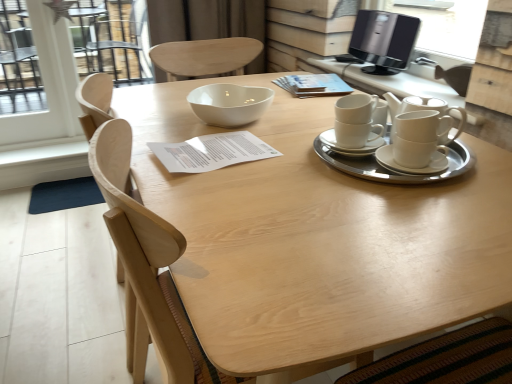
This screenshot has height=384, width=512. Identify the location of black glossy computer monitor at upper right. (383, 40).

Measure the distance between white ceramic tea set at right and camera.

The depth of white ceramic tea set at right is 35.35 inches.

The image size is (512, 384). What do you see at coordinates (147, 267) in the screenshot? I see `light wood chair at center` at bounding box center [147, 267].

The height and width of the screenshot is (384, 512). Identify the location of white ceramic saucer at right. (350, 148).

Where is `white ceramic cups at upper right, the second table ordered from the bottom`? The image size is (512, 384). white ceramic cups at upper right, the second table ordered from the bottom is located at coordinates (389, 82).

Image resolution: width=512 pixels, height=384 pixels. What are the coordinates of `black glossy computer monitor at upper right` in the screenshot? It's located at (383, 40).

Is black glossy computer monitor at upper right wider or thinner than white ceramic saucer at right?

In the image, black glossy computer monitor at upper right appears to be wider than white ceramic saucer at right.

Image resolution: width=512 pixels, height=384 pixels. I want to click on saucer that appears on the left of black glossy computer monitor at upper right, so click(350, 148).

Is black glossy computer monitor at upper right shorter than white ceramic saucer at right?

No.

Can you tell me how much black glossy computer monitor at upper right and white ceramic saucer at right differ in facing direction?

2.82 degrees.

Between white glossy bowl at center and light wood chair at center, which one is positioned behind?

white glossy bowl at center is further from the camera.

Is point (227, 91) behind point (106, 147)?

Yes, point (227, 91) is behind point (106, 147).

Does white glossy bowl at center appear on the right side of light wood chair at center?

Indeed, white glossy bowl at center is positioned on the right side of light wood chair at center.

In terms of size, does white glossy bowl at center appear bigger or smaller than light wood chair at center?

In the image, white glossy bowl at center appears to be smaller than light wood chair at center.

Is white ceramic cups at upper right, which appears as the first table when viewed from the top, in front of natural wood table at center, the 2th table viewed from the top?

No, the depth of white ceramic cups at upper right, which appears as the first table when viewed from the top, is greater than that of natural wood table at center, the 2th table viewed from the top.

Does white ceramic cups at upper right, which appears as the first table when viewed from the top, have a larger size compared to natural wood table at center, which is the 1th table in bottom-to-top order?

No, white ceramic cups at upper right, which appears as the first table when viewed from the top, is not bigger than natural wood table at center, which is the 1th table in bottom-to-top order.

Is black glossy computer monitor at upper right at the left side of white glossy bowl at center?

In fact, black glossy computer monitor at upper right is to the right of white glossy bowl at center.

Choose the correct answer: Is black glossy computer monitor at upper right inside white glossy bowl at center or outside it?

The correct answer is: outside.

In terms of size, does black glossy computer monitor at upper right appear bigger or smaller than white glossy bowl at center?

In the image, black glossy computer monitor at upper right appears to be larger than white glossy bowl at center.

Considering the sizes of white ceramic tea set at right and natural wood table at center, the 2th table viewed from the top, in the image, is white ceramic tea set at right bigger or smaller than natural wood table at center, the 2th table viewed from the top,?

white ceramic tea set at right is smaller than natural wood table at center, the 2th table viewed from the top.

From a real-world perspective, who is located lower, white ceramic tea set at right or natural wood table at center, the 2th table viewed from the top?

natural wood table at center, the 2th table viewed from the top, is physically lower.

From the image's perspective, is white ceramic tea set at right under natural wood table at center, which is the 1th table in bottom-to-top order?

No, from the image's perspective, white ceramic tea set at right is not beneath natural wood table at center, which is the 1th table in bottom-to-top order.

Is white ceramic tea set at right taller or shorter than natural wood table at center, the 2th table viewed from the top?

In the image, white ceramic tea set at right appears to be shorter than natural wood table at center, the 2th table viewed from the top.

Can you confirm if natural wood table at center, the 2th table viewed from the top, is wider than white ceramic saucer at right?

Yes, natural wood table at center, the 2th table viewed from the top, is wider than white ceramic saucer at right.

Which is more to the left, natural wood table at center, which is the 1th table in bottom-to-top order, or white ceramic saucer at right?

natural wood table at center, which is the 1th table in bottom-to-top order, is more to the left.

From the image's perspective, is natural wood table at center, the 2th table viewed from the top, on white ceramic saucer at right?

Incorrect, from the image's perspective, natural wood table at center, the 2th table viewed from the top, is lower than white ceramic saucer at right.

Considering the sizes of objects natural wood table at center, the 2th table viewed from the top, and white ceramic saucer at right in the image provided, who is bigger, natural wood table at center, the 2th table viewed from the top, or white ceramic saucer at right?

natural wood table at center, the 2th table viewed from the top, is bigger.

Is white glossy bowl at center positioned with its back to white ceramic cups at upper right, which appears as the first table when viewed from the top?

Yes, white glossy bowl at center is facing away from white ceramic cups at upper right, which appears as the first table when viewed from the top.

How different are the orientations of white glossy bowl at center and white ceramic cups at upper right, which appears as the first table when viewed from the top, in degrees?

They differ by 1.26 degrees in their facing directions.

From the image's perspective, which one is positioned higher, white glossy bowl at center or white ceramic cups at upper right, which appears as the first table when viewed from the top?

white ceramic cups at upper right, which appears as the first table when viewed from the top, is shown above in the image.

Considering the sizes of objects white glossy bowl at center and white ceramic cups at upper right, which appears as the first table when viewed from the top, in the image provided, who is thinner, white glossy bowl at center or white ceramic cups at upper right, which appears as the first table when viewed from the top,?

Thinner between the two is white ceramic cups at upper right, which appears as the first table when viewed from the top.

This screenshot has height=384, width=512. I want to click on saucer that appears on the left of black glossy computer monitor at upper right, so click(x=350, y=148).

At what (x,y) coordinates should I click in order to perform the action: click on bowl located above the light wood chair at center (from the image's perspective). Please return your answer as a coordinate pair (x, y). This screenshot has height=384, width=512. Looking at the image, I should click on (229, 104).

When comparing their distances from black glossy computer monitor at upper right, does white ceramic tea set at right or white ceramic cups at upper right, the second table ordered from the bottom, seem further?

white ceramic tea set at right is positioned further to the anchor black glossy computer monitor at upper right.

Estimate the real-world distances between objects in this image. Which object is closer to white ceramic cups at upper right, the second table ordered from the bottom, white ceramic saucer at right or white ceramic tea set at right?

Among the two, white ceramic tea set at right is located nearer to white ceramic cups at upper right, the second table ordered from the bottom.

Considering their positions, is light wood chair at center positioned closer to white ceramic tea set at right than white glossy bowl at center?

white glossy bowl at center is positioned closer to the anchor white ceramic tea set at right.

Which object lies nearer to the anchor point black glossy computer monitor at upper right, natural wood table at center, which is the 1th table in bottom-to-top order, or white ceramic tea set at right?

white ceramic tea set at right.

Considering their positions, is white ceramic saucer at right positioned closer to light wood chair at center than natural wood table at center, which is the 1th table in bottom-to-top order?

natural wood table at center, which is the 1th table in bottom-to-top order, is closer to light wood chair at center.

Considering their positions, is natural wood table at center, the 2th table viewed from the top, positioned closer to white glossy bowl at center than black glossy computer monitor at upper right?

Based on the image, natural wood table at center, the 2th table viewed from the top, appears to be nearer to white glossy bowl at center.

From the image, which object appears to be nearer to white ceramic cups at upper right, which appears as the first table when viewed from the top, white glossy bowl at center or natural wood table at center, the 2th table viewed from the top?

white glossy bowl at center.

Which object lies further to the anchor point white ceramic tea set at right, natural wood table at center, the 2th table viewed from the top, or white ceramic cups at upper right, the second table ordered from the bottom?

white ceramic cups at upper right, the second table ordered from the bottom, lies further to white ceramic tea set at right than the other object.

Identify the location of bowl between natural wood table at center, the 2th table viewed from the top, and white ceramic cups at upper right, the second table ordered from the bottom, along the z-axis. (229, 104).

The width and height of the screenshot is (512, 384). In order to click on tea set between natural wood table at center, which is the 1th table in bottom-to-top order, and white ceramic cups at upper right, the second table ordered from the bottom, in the front-back direction in this screenshot , I will do `click(375, 163)`.

Locate an element on the screen. This screenshot has width=512, height=384. tea set between natural wood table at center, which is the 1th table in bottom-to-top order, and white glossy bowl at center from front to back is located at coordinates (375, 163).

Find the location of a particular element. This screenshot has height=384, width=512. computer monitor between white glossy bowl at center and white ceramic cups at upper right, which appears as the first table when viewed from the top, in the horizontal direction is located at coordinates (383, 40).